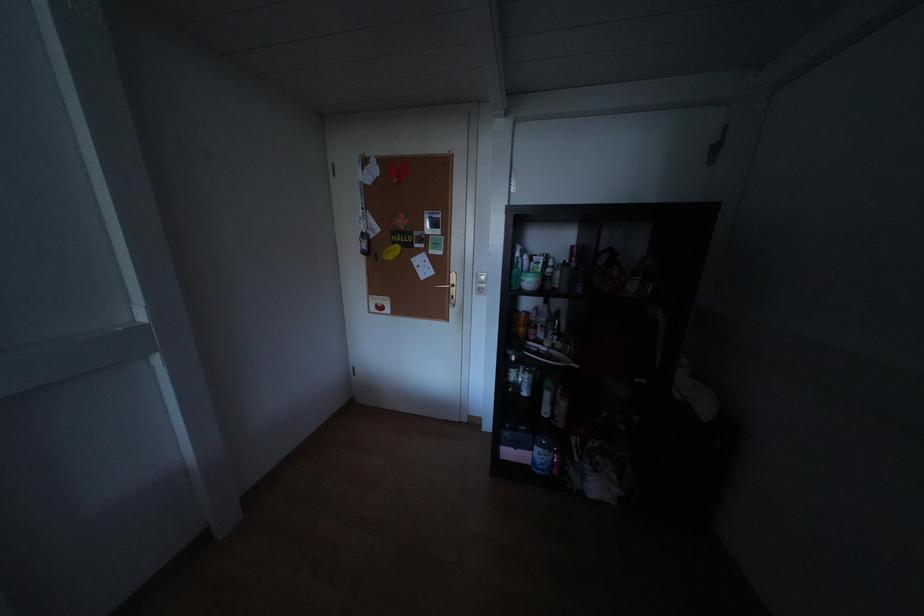
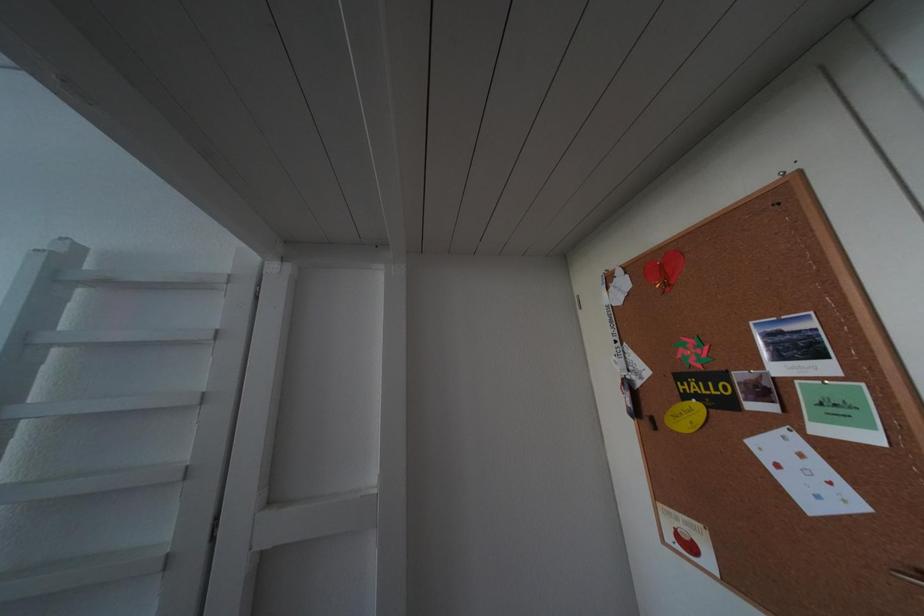
First-person continuous shooting, in which direction is the camera rotating?

The camera rotated toward left-up.